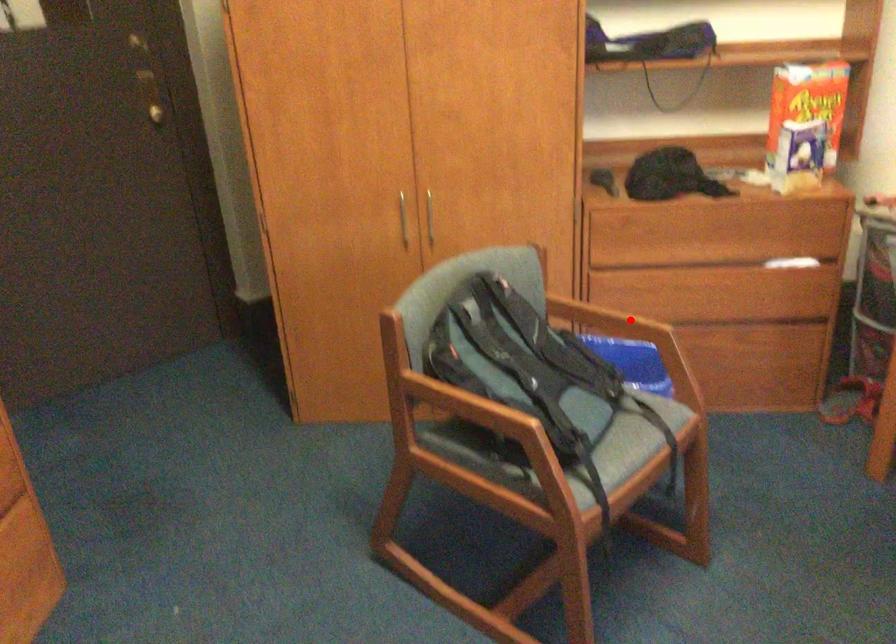
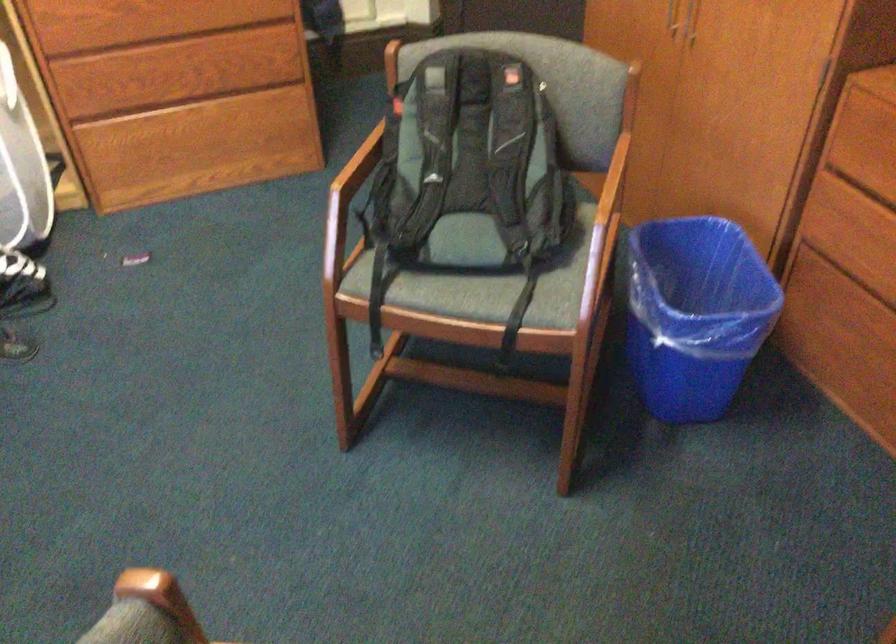
Question: I am providing you with two images of the same scene from different viewpoints. Given a red point in image1, look at the same physical point in image2. Is it:

Choices:
 (A) Closer to the viewpoint
 (B) Farther from the viewpoint

Answer: (A)